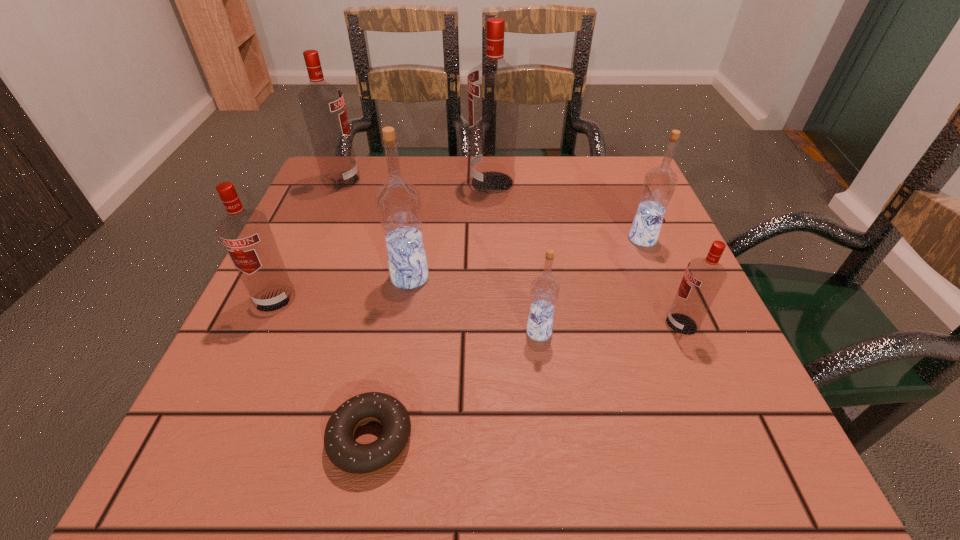
The height and width of the screenshot is (540, 960). Identify the location of free spot between the second smallest red vodka and the nearest object. (323, 369).

Identify the location of free space between the third smallest red vodka and the third farthest object. (492, 210).

I want to click on free spot between the smallest red vodka and the third red vodka from left to right, so click(587, 253).

Identify the location of free space between the second biggest red vodka and the rightmost blue vodka. (492, 210).

Locate which object is the sixth closest to the biggest blue vodka. Please provide its 2D coordinates. Your answer should be formatted as a tuple, i.e. [(x, y)], where the tuple contains the x and y coordinates of a point satisfying the conditions above.

[(659, 184)]

Identify which object is the seventh closest to the third smallest red vodka. Please provide its 2D coordinates. Your answer should be formatted as a tuple, i.e. [(x, y)], where the tuple contains the x and y coordinates of a point satisfying the conditions above.

[(703, 278)]

Locate which vodka is the second closest to the rightmost red vodka. Please provide its 2D coordinates. Your answer should be formatted as a tuple, i.e. [(x, y)], where the tuple contains the x and y coordinates of a point satisfying the conditions above.

[(544, 291)]

Select which vodka is the third closest to the third biggest red vodka. Please provide its 2D coordinates. Your answer should be formatted as a tuple, i.e. [(x, y)], where the tuple contains the x and y coordinates of a point satisfying the conditions above.

[(544, 291)]

Find the location of a particular element. red vodka that stands as the third closest to the biggest blue vodka is located at coordinates (322, 104).

You are a GUI agent. You are given a task and a screenshot of the screen. Output one action in this format:
    pyautogui.click(x=<x>, y=<y>)
    Task: Click on the red vodka identified as the second closest to the nearest blue vodka
    
    Given the screenshot: What is the action you would take?
    pyautogui.click(x=494, y=86)